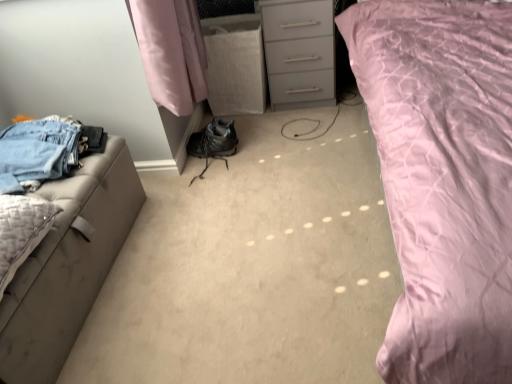
Question: Does point (83, 273) appear closer or farther from the camera than point (6, 279)?

Choices:
 (A) closer
 (B) farther

Answer: (B)

Question: Considering their positions, is leatherette ottoman at left located in front of or behind textured beige pillow at left?

Choices:
 (A) behind
 (B) front

Answer: (A)

Question: Which is farther from the matte gray chest of drawers at center?

Choices:
 (A) denim jeans at left
 (B) leatherette ottoman at left
 (C) pink quilted fabric at upper right
 (D) textured beige pillow at left

Answer: (D)

Question: Based on their relative distances, which object is nearer to the textured beige pillow at left?

Choices:
 (A) leatherette ottoman at left
 (B) denim jeans at left
 (C) pink quilted fabric at upper right
 (D) matte gray chest of drawers at center

Answer: (A)